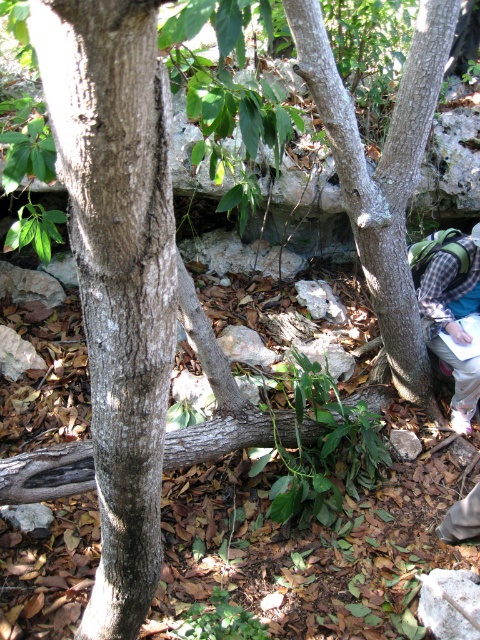
Question: Is plaid fabric at lower right above gray rough stone at lower right?

Choices:
 (A) yes
 (B) no

Answer: (A)

Question: Which point is closer to the camera?

Choices:
 (A) gray rough stone at lower right
 (B) plaid fabric at lower right

Answer: (A)

Question: Among these points, which one is farthest from the camera?

Choices:
 (A) (446, 349)
 (B) (427, 577)
 (C) (379, 284)

Answer: (A)

Question: Which of the following is the closest to the observer?

Choices:
 (A) (288, 26)
 (B) (451, 618)

Answer: (A)

Question: From the image, what is the correct spatial relationship of plaid fabric at lower right in relation to gray rough stone at lower right?

Choices:
 (A) left
 (B) right

Answer: (B)

Question: Is smooth bark tree at lower right bigger than plaid fabric at lower right?

Choices:
 (A) no
 (B) yes

Answer: (B)